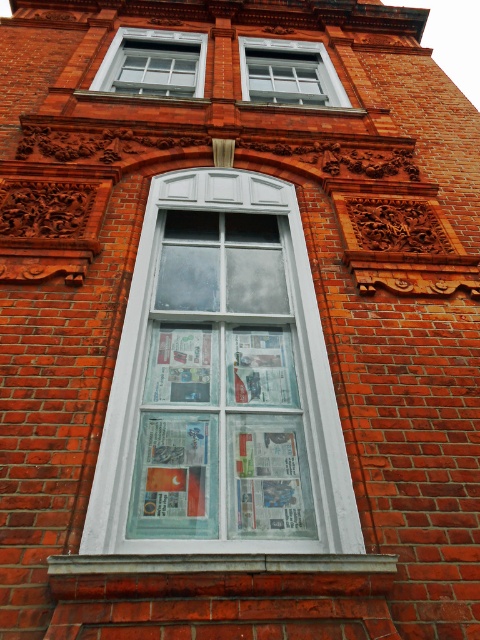
Question: Does white glass window at center come behind clear glass window at upper center?

Choices:
 (A) no
 (B) yes

Answer: (A)

Question: From the image, what is the correct spatial relationship of clear glass window at upper center in relation to white glass window at upper center?

Choices:
 (A) above
 (B) below

Answer: (A)

Question: Which point is farther to the camera?

Choices:
 (A) white glass window at center
 (B) clear glass window at upper center
 (C) white glass window at upper center

Answer: (C)

Question: Which of the following is the closest to the observer?

Choices:
 (A) (229, 216)
 (B) (175, 52)

Answer: (A)

Question: Does white glass window at center appear over clear glass window at upper center?

Choices:
 (A) yes
 (B) no

Answer: (B)

Question: Which point is closer to the camera taking this photo?

Choices:
 (A) (250, 285)
 (B) (326, 52)
 (C) (127, 29)

Answer: (A)